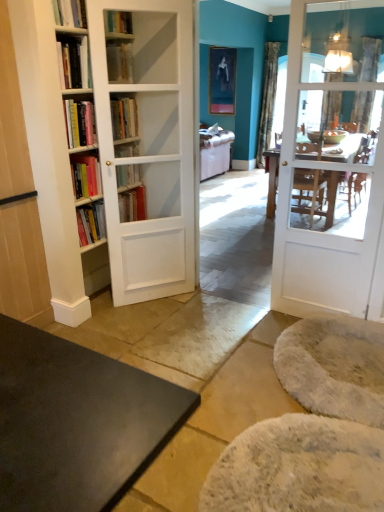
The width and height of the screenshot is (384, 512). I want to click on free region under white glossy bookcase at left (from a real-world perspective), so click(153, 301).